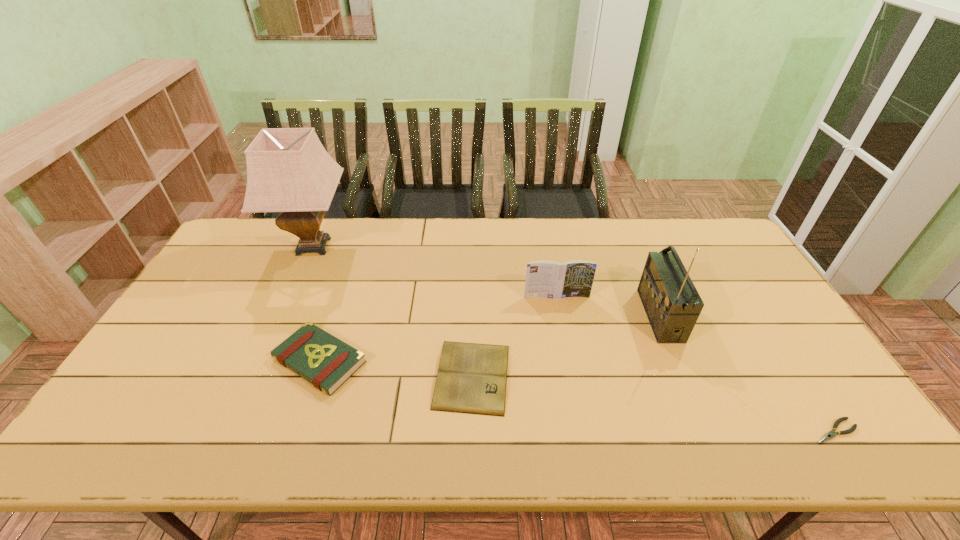
The height and width of the screenshot is (540, 960). I want to click on the tallest object, so click(x=289, y=171).

The width and height of the screenshot is (960, 540). Find the location of `lampshade`. lampshade is located at coordinates (289, 171).

You are a GUI agent. You are given a task and a screenshot of the screen. Output one action in this format:
    pyautogui.click(x=<x>, y=<y>)
    Task: Click on the second object from right to left
    The height and width of the screenshot is (540, 960).
    Given the screenshot: What is the action you would take?
    pyautogui.click(x=671, y=301)

In order to click on the fifth shortest object in this screenshot , I will do `click(671, 301)`.

You are a GUI agent. You are given a task and a screenshot of the screen. Output one action in this format:
    pyautogui.click(x=<x>, y=<y>)
    Task: Click on the farthest book
    
    Given the screenshot: What is the action you would take?
    pyautogui.click(x=550, y=279)

Find the location of `the tallest book`. the tallest book is located at coordinates (550, 279).

Identify the location of the third shortest object. (x=325, y=361).

This screenshot has height=540, width=960. In order to click on the leftmost book in this screenshot , I will do `click(325, 361)`.

The height and width of the screenshot is (540, 960). Find the location of `the second book from right to left`. the second book from right to left is located at coordinates (472, 377).

Find the location of a particular element. the fourth object from right to left is located at coordinates (472, 377).